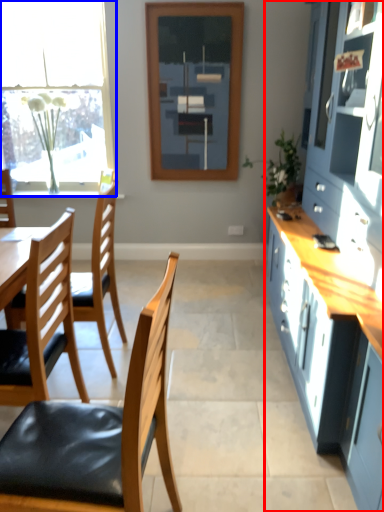
Question: Which point is closer to the camera, cabinetry (highlighted by a red box) or window (highlighted by a blue box)?

Choices:
 (A) cabinetry
 (B) window

Answer: (A)